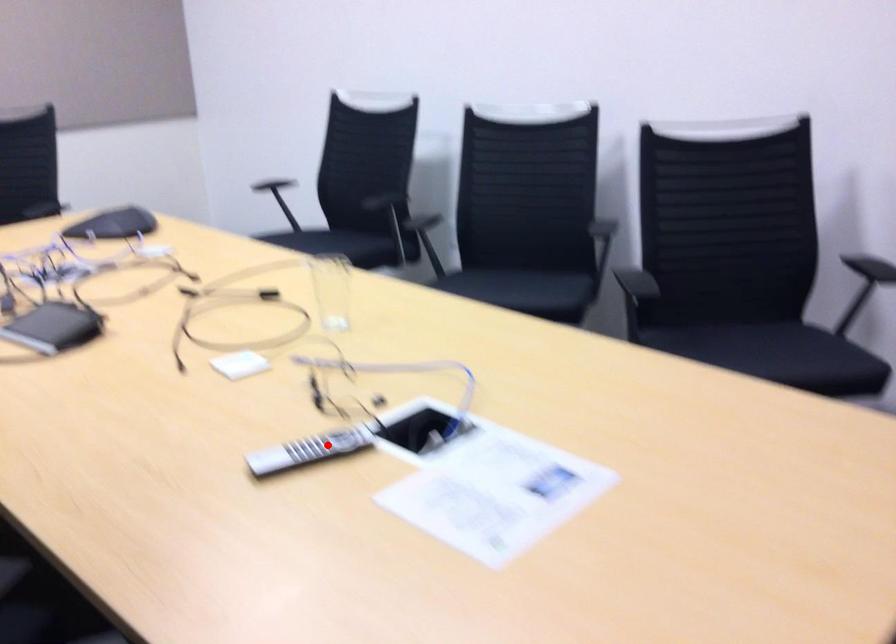
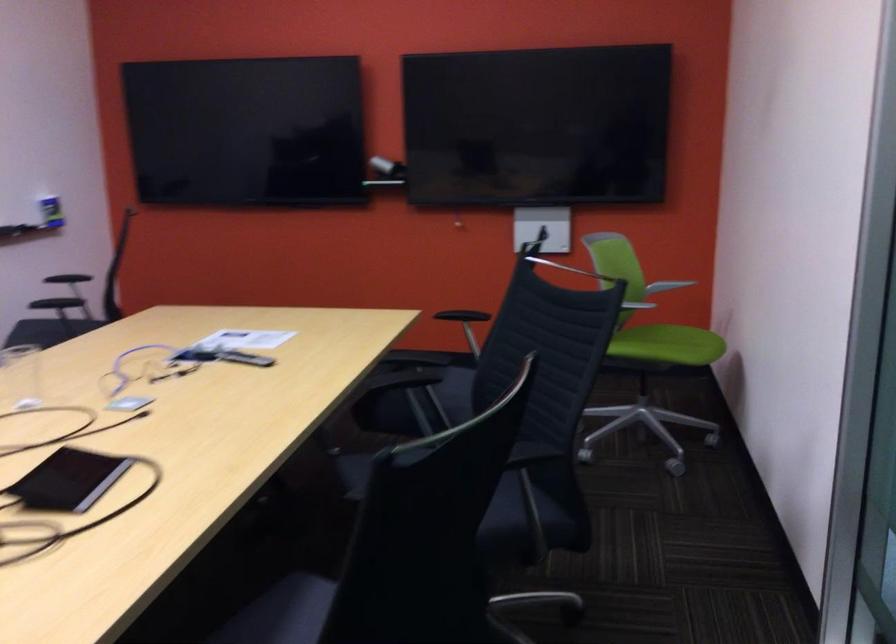
Question: I am providing you with two images of the same scene from different viewpoints. A red point is shown in image1. For the corresponding object point in image2, is it positioned nearer or farther from the camera?

Choices:
 (A) Nearer
 (B) Farther

Answer: (B)